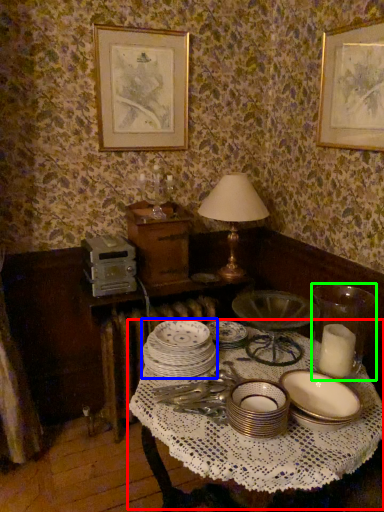
Question: Which is nearer to the round table (highlighted by a red box)? tableware (highlighted by a blue box) or tableware (highlighted by a green box).

Choices:
 (A) tableware
 (B) tableware

Answer: (A)